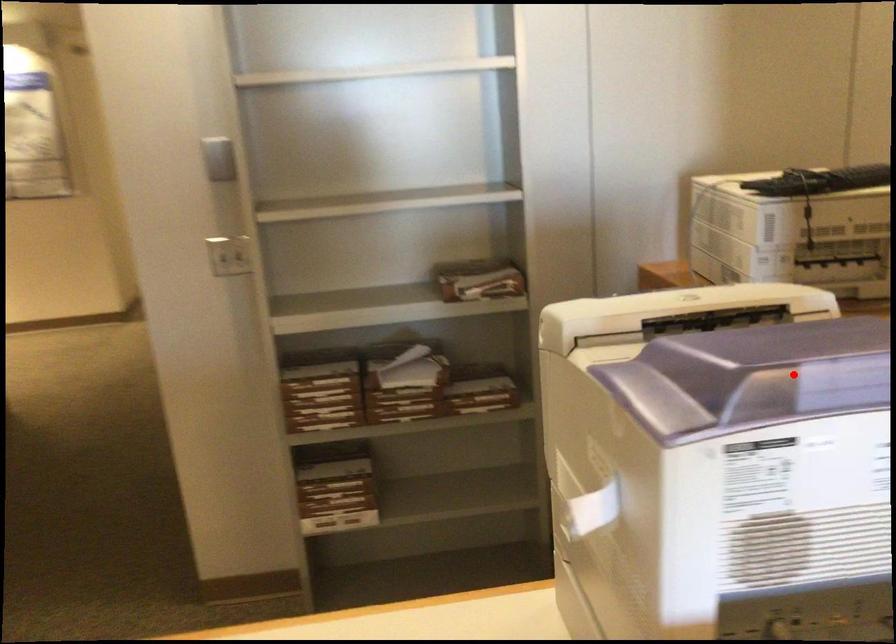
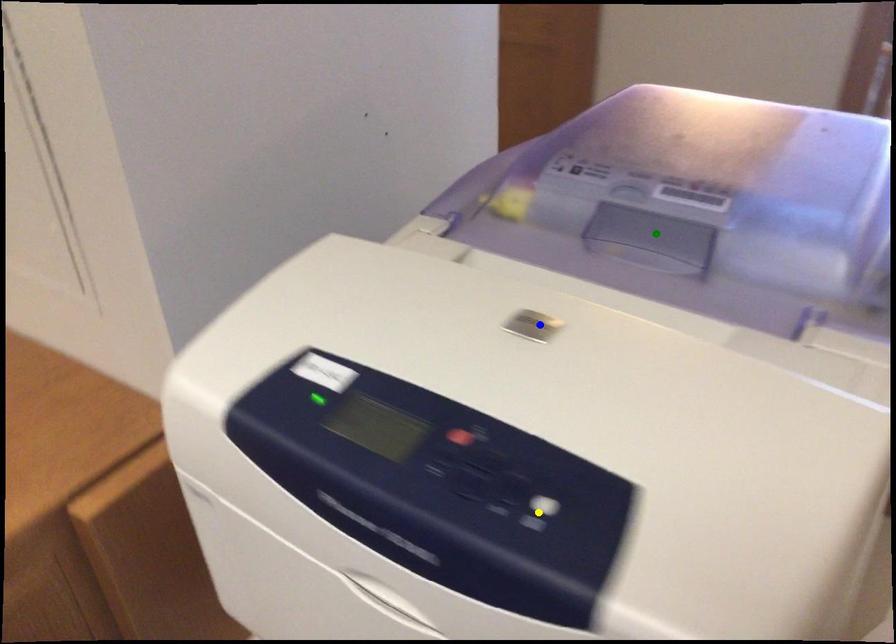
Question: I am providing you with two images of the same scene from different viewpoints. A red point is marked on the first image. You are given multiple points on the second image. Which spot in image 2 lines up with the point in image 1?

Choices:
 (A) blue point
 (B) yellow point
 (C) green point

Answer: (C)